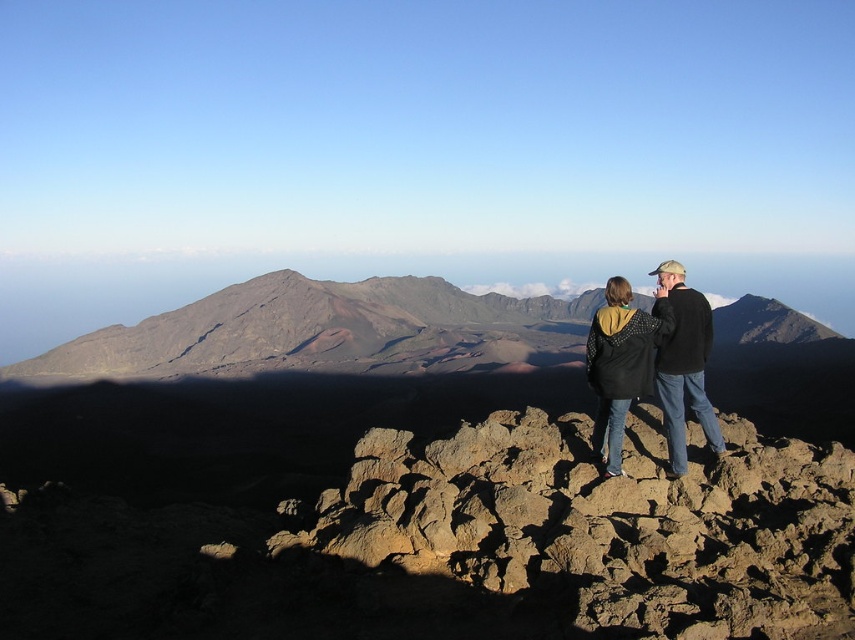
Question: Can you confirm if rustic brown mountain at center is positioned to the left of black jacket at center?

Choices:
 (A) no
 (B) yes

Answer: (A)

Question: Is brown rough rocks at center further to the viewer compared to rustic brown mountain at center?

Choices:
 (A) no
 (B) yes

Answer: (A)

Question: Which object appears closest to the camera in this image?

Choices:
 (A) black jacket at center
 (B) rustic brown mountain at center

Answer: (A)

Question: Can you confirm if brown rough rocks at center is bigger than black jacket at center?

Choices:
 (A) yes
 (B) no

Answer: (A)

Question: Based on their relative distances, which object is farther from the brown rough rocks at center?

Choices:
 (A) black jacket at center
 (B) rustic brown mountain at center

Answer: (B)

Question: Which of the following is the closest to the observer?

Choices:
 (A) black jacket at center
 (B) brown rough rocks at center

Answer: (B)